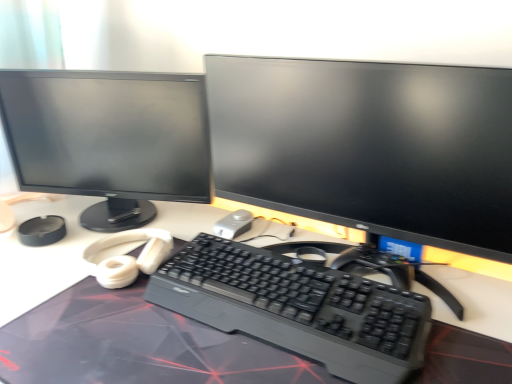
You are a GUI agent. You are given a task and a screenshot of the screen. Output one action in this format:
    pyautogui.click(x=<x>, y=<y>)
    Task: Click on the black plastic keyboard at center
    The height and width of the screenshot is (384, 512).
    Given the screenshot: What is the action you would take?
    (x=297, y=308)

What do you see at coordinates (109, 139) in the screenshot? This screenshot has height=384, width=512. I see `matte black monitor at left, arranged as the first computer monitor when viewed from the left` at bounding box center [109, 139].

The image size is (512, 384). In order to click on matte black monitor at center, the 2th computer monitor when ordered from left to right in this screenshot , I will do `click(369, 146)`.

Measure the distance between point (3, 360) and camera.

The depth of point (3, 360) is 23.98 inches.

At what (x,y) coordinates should I click in order to perform the action: click on satin silver mouse at center. Please return your answer as a coordinate pair (x, y). Looking at the image, I should click on (233, 224).

Is matte black monitor at left, which is counted as the second computer monitor, starting from the right, to the left or to the right of black plastic keyboard at center in the image?

Based on their positions, matte black monitor at left, which is counted as the second computer monitor, starting from the right, is located to the left of black plastic keyboard at center.

Which object is further away from the camera taking this photo, matte black monitor at left, which is counted as the second computer monitor, starting from the right, or black plastic keyboard at center?

matte black monitor at left, which is counted as the second computer monitor, starting from the right, is behind.

Considering the relative sizes of matte black monitor at left, arranged as the first computer monitor when viewed from the left, and black plastic keyboard at center in the image provided, is matte black monitor at left, arranged as the first computer monitor when viewed from the left, bigger than black plastic keyboard at center?

Correct, matte black monitor at left, arranged as the first computer monitor when viewed from the left, is larger in size than black plastic keyboard at center.

Does matte black monitor at left, which is counted as the second computer monitor, starting from the right, have a lesser width compared to black plastic keyboard at center?

No.

Which is more to the right, black plastic keyboard at center or black matte desk at center?

From the viewer's perspective, black plastic keyboard at center appears more on the right side.

Does black plastic keyboard at center have a lesser height compared to black matte desk at center?

Indeed, black plastic keyboard at center has a lesser height compared to black matte desk at center.

Is black matte desk at center at the back of black plastic keyboard at center?

No, black plastic keyboard at center's orientation is not away from black matte desk at center.

Which of these two, black plastic keyboard at center or black matte desk at center, is wider?

black matte desk at center.

Where is `computer monitor below the matte black monitor at left, which is counted as the second computer monitor, starting from the right (from the image's perspective)`? computer monitor below the matte black monitor at left, which is counted as the second computer monitor, starting from the right (from the image's perspective) is located at coordinates (369, 146).

Can we say matte black monitor at center, the 2th computer monitor when ordered from left to right, lies outside matte black monitor at left, which is counted as the second computer monitor, starting from the right?

matte black monitor at center, the 2th computer monitor when ordered from left to right, is positioned outside matte black monitor at left, which is counted as the second computer monitor, starting from the right.

Considering the points (381, 164) and (50, 96), which point is behind, point (381, 164) or point (50, 96)?

The point (50, 96) is behind.

Considering the positions of objects black plastic keyboard at center and satin silver mouse at center in the image provided, who is in front, black plastic keyboard at center or satin silver mouse at center?

Positioned in front is black plastic keyboard at center.

From a real-world perspective, is black plastic keyboard at center positioned under satin silver mouse at center based on gravity?

Actually, black plastic keyboard at center is physically above satin silver mouse at center in the real world.

Would you say black plastic keyboard at center is outside satin silver mouse at center?

Yes, black plastic keyboard at center is outside of satin silver mouse at center.

Considering the relative sizes of black plastic keyboard at center and satin silver mouse at center in the image provided, is black plastic keyboard at center smaller than satin silver mouse at center?

Incorrect, black plastic keyboard at center is not smaller in size than satin silver mouse at center.

Identify the location of the 1st computer monitor above the black matte desk at center (from a real-world perspective). This screenshot has width=512, height=384. (109, 139).

In the image, is black matte desk at center positioned in front of or behind matte black monitor at left, which is counted as the second computer monitor, starting from the right?

In the image, black matte desk at center appears in front of matte black monitor at left, which is counted as the second computer monitor, starting from the right.

Is black matte desk at center facing towards matte black monitor at left, arranged as the first computer monitor when viewed from the left?

No, black matte desk at center is not oriented towards matte black monitor at left, arranged as the first computer monitor when viewed from the left.

Can you confirm if black matte desk at center is taller than matte black monitor at left, arranged as the first computer monitor when viewed from the left?

Indeed, black matte desk at center has a greater height compared to matte black monitor at left, arranged as the first computer monitor when viewed from the left.

Who is taller, satin silver mouse at center or black matte desk at center?

black matte desk at center is taller.

Which is more to the right, satin silver mouse at center or black matte desk at center?

From the viewer's perspective, satin silver mouse at center appears more on the right side.

Considering the sizes of objects satin silver mouse at center and black matte desk at center in the image provided, who is bigger, satin silver mouse at center or black matte desk at center?

black matte desk at center is bigger.

Are black matte desk at center and matte black monitor at center, the 2th computer monitor when ordered from left to right, making contact?

There is a gap between black matte desk at center and matte black monitor at center, the 2th computer monitor when ordered from left to right.

From the image's perspective, starting from the black matte desk at center, which computer monitor is the 1st one above? Please provide its 2D coordinates.

[(369, 146)]

In terms of size, does black matte desk at center appear bigger or smaller than matte black monitor at center, the 2th computer monitor when ordered from left to right?

black matte desk at center is bigger than matte black monitor at center, the 2th computer monitor when ordered from left to right.

From a real-world perspective, is black matte desk at center above or below matte black monitor at center, the 2th computer monitor when ordered from left to right?

black matte desk at center is below matte black monitor at center, the 2th computer monitor when ordered from left to right.

Locate an element on the screen. Image resolution: width=512 pixels, height=384 pixels. computer keyboard below the matte black monitor at left, arranged as the first computer monitor when viewed from the left (from the image's perspective) is located at coordinates (297, 308).

Find the location of a particular element. This screenshot has height=384, width=512. computer keyboard behind the black matte desk at center is located at coordinates pos(297,308).

From the image, which object appears to be nearer to satin silver mouse at center, matte black monitor at left, which is counted as the second computer monitor, starting from the right, or matte black monitor at center, which is the 1th computer monitor in right-to-left order?

matte black monitor at center, which is the 1th computer monitor in right-to-left order, is positioned closer to the anchor satin silver mouse at center.

In the scene shown: Looking at the image, which one is located closer to matte black monitor at left, arranged as the first computer monitor when viewed from the left, matte black monitor at center, which is the 1th computer monitor in right-to-left order, or satin silver mouse at center?

Among the two, matte black monitor at center, which is the 1th computer monitor in right-to-left order, is located nearer to matte black monitor at left, arranged as the first computer monitor when viewed from the left.

Considering their positions, is matte black monitor at left, arranged as the first computer monitor when viewed from the left, positioned further to black plastic keyboard at center than satin silver mouse at center?

The object further to black plastic keyboard at center is matte black monitor at left, arranged as the first computer monitor when viewed from the left.

Based on their spatial positions, is matte black monitor at center, the 2th computer monitor when ordered from left to right, or matte black monitor at left, which is counted as the second computer monitor, starting from the right, further from satin silver mouse at center?

matte black monitor at left, which is counted as the second computer monitor, starting from the right, lies further to satin silver mouse at center than the other object.

Which object lies further to the anchor point black matte desk at center, matte black monitor at left, which is counted as the second computer monitor, starting from the right, or black plastic keyboard at center?

matte black monitor at left, which is counted as the second computer monitor, starting from the right, is further to black matte desk at center.

From the image, which object appears to be farther from black matte desk at center, matte black monitor at center, which is the 1th computer monitor in right-to-left order, or black plastic keyboard at center?

Based on the image, matte black monitor at center, which is the 1th computer monitor in right-to-left order, appears to be further to black matte desk at center.

Which object lies further to the anchor point black matte desk at center, matte black monitor at left, which is counted as the second computer monitor, starting from the right, or satin silver mouse at center?

satin silver mouse at center.

Which object lies nearer to the anchor point satin silver mouse at center, black matte desk at center or matte black monitor at center, the 2th computer monitor when ordered from left to right?

black matte desk at center is positioned closer to the anchor satin silver mouse at center.

What are the coordinates of `computer keyboard positioned between black matte desk at center and satin silver mouse at center from near to far` in the screenshot? It's located at (297, 308).

Identify the location of mouse between matte black monitor at left, arranged as the first computer monitor when viewed from the left, and matte black monitor at center, the 2th computer monitor when ordered from left to right, in the horizontal direction. The height and width of the screenshot is (384, 512). (233, 224).

Locate an element on the screen. This screenshot has width=512, height=384. computer keyboard situated between matte black monitor at left, arranged as the first computer monitor when viewed from the left, and matte black monitor at center, which is the 1th computer monitor in right-to-left order, from left to right is located at coordinates (297, 308).

Where is `computer keyboard between matte black monitor at left, arranged as the first computer monitor when viewed from the left, and black matte desk at center, in the vertical direction`? The image size is (512, 384). computer keyboard between matte black monitor at left, arranged as the first computer monitor when viewed from the left, and black matte desk at center, in the vertical direction is located at coordinates (297, 308).